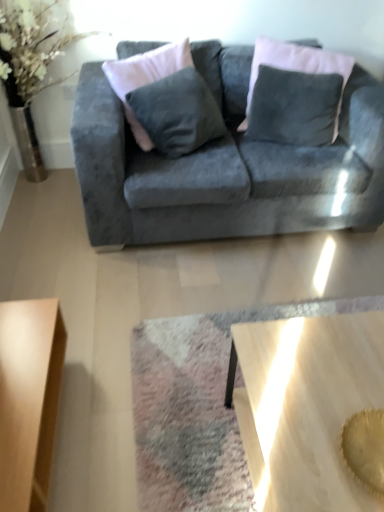
Where is `empty space that is in between light brown wooden coffee table at lower left, which ranks as the 2th coffee table in right-to-left order, and wooden polished coffee table at lower center, arranged as the second coffee table when viewed from the left`? The height and width of the screenshot is (512, 384). empty space that is in between light brown wooden coffee table at lower left, which ranks as the 2th coffee table in right-to-left order, and wooden polished coffee table at lower center, arranged as the second coffee table when viewed from the left is located at coordinates (140, 429).